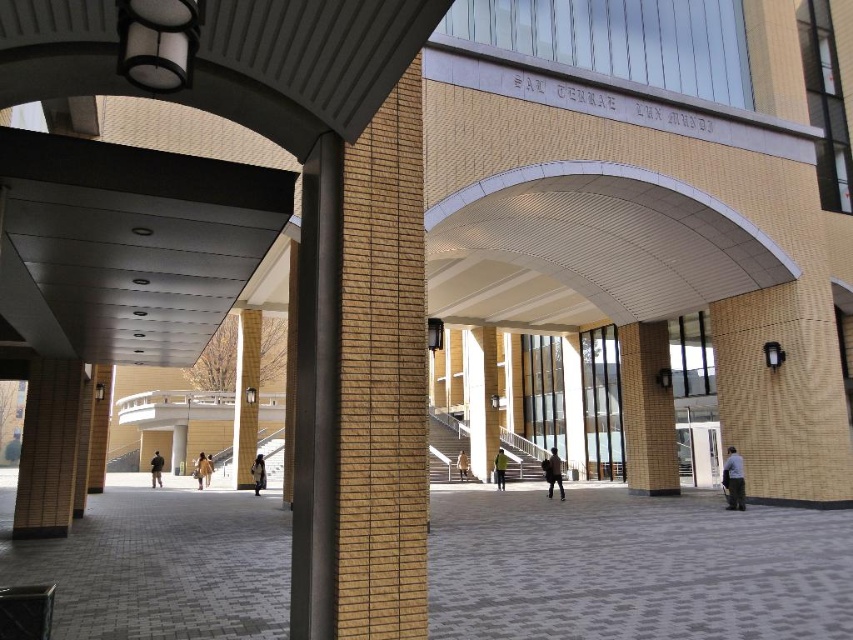
Can you confirm if yellow brick pillar at center is shorter than light beige coat at center?

No.

Who is more forward, (x=236, y=408) or (x=467, y=464)?

Positioned in front is point (x=236, y=408).

Describe the element at coordinates (247, 396) in the screenshot. I see `yellow brick pillar at center` at that location.

Identify the location of yellow brick pillar at center. (247, 396).

In the scene shown: Which is below, gray brick pavement at center or brown brick pillar at center?

brown brick pillar at center is lower down.

Is gray brick pavement at center bigger than brown brick pillar at center?

Yes, gray brick pavement at center is bigger than brown brick pillar at center.

Image resolution: width=853 pixels, height=640 pixels. Find the location of `gray brick pavement at center`. gray brick pavement at center is located at coordinates (634, 568).

At what (x,y) coordinates should I click in order to perform the action: click on gray brick pavement at center. Please return your answer as a coordinate pair (x, y). Looking at the image, I should click on (634, 568).

Can you confirm if brown brick pillar at center is shorter than dark blue jeans at center?

Indeed, brown brick pillar at center has a lesser height compared to dark blue jeans at center.

Who is positioned more to the left, brown brick pillar at center or dark blue jeans at center?

dark blue jeans at center is more to the left.

Based on the photo, who is more forward, (636,438) or (498,488)?

Point (636,438) is in front.

This screenshot has width=853, height=640. Find the location of `brown brick pillar at center`. brown brick pillar at center is located at coordinates (647, 410).